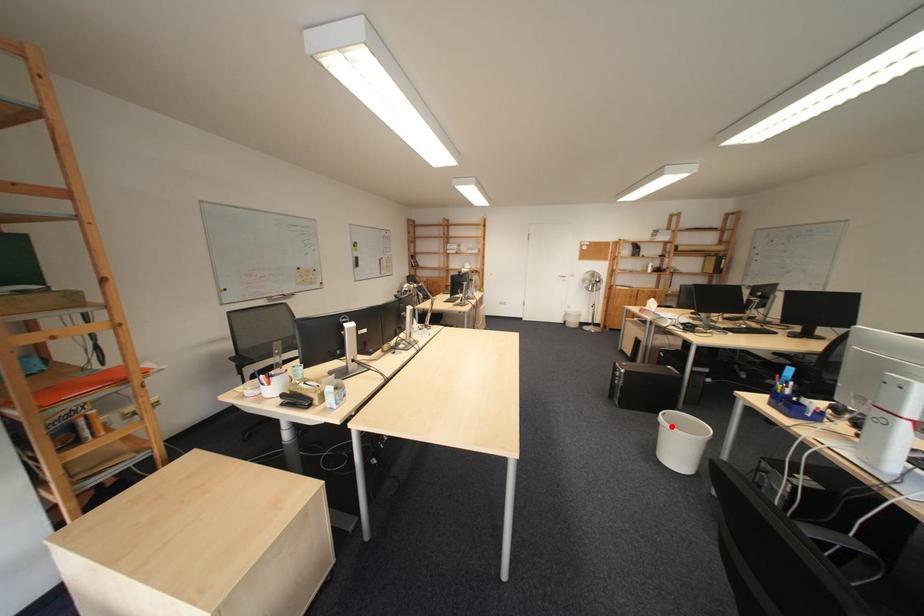
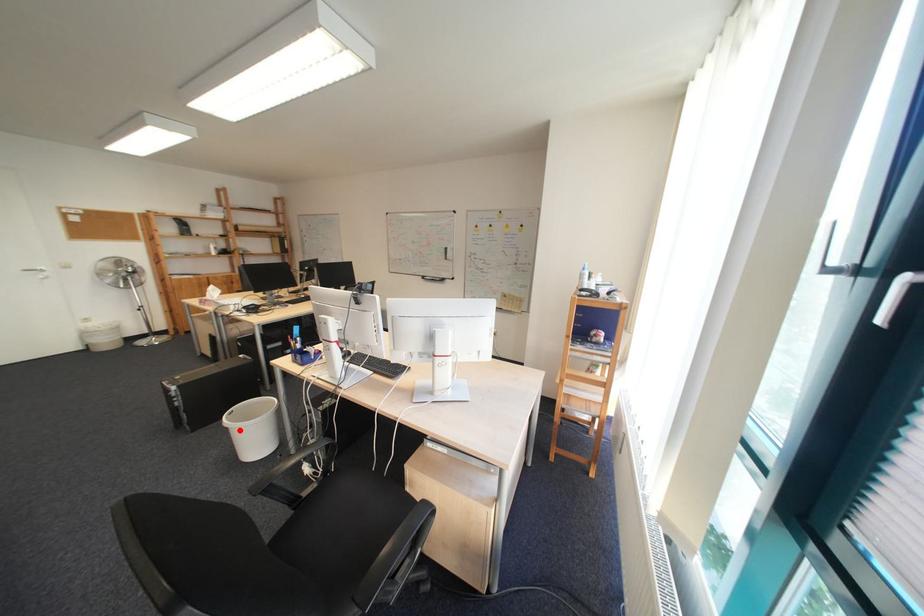
I am providing you with two images of the same scene from different viewpoints. A red point is marked on the first image and another point is marked on the second image. Do the highlighted points in image1 and image2 indicate the same real-world spot?

Yes